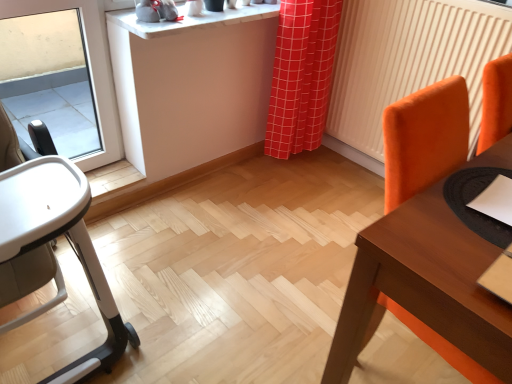
The height and width of the screenshot is (384, 512). What are the coordinates of `free space to the left of wooden table at right` in the screenshot? It's located at (247, 274).